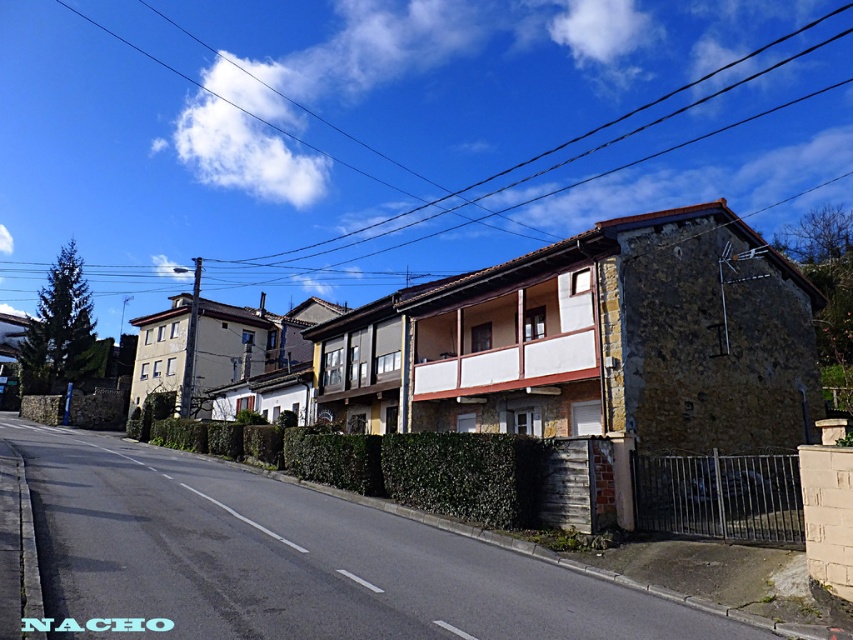
You are a delivery drone flying above the residential street scene. You need to deliver a package to a house near the green leafy hedge at center. However, you must avoid the brown wooden power line at upper center. Which object should you fly under first to navigate safely?

You should fly under the brown wooden power line at upper center first because it is closer to you than the green leafy hedge at center, so you need to pass under it before reaching the hedge.

You are a painter standing on the sidewalk and want to paint the brown wooden power line at upper center and the green leafy hedge at center. Which object should you focus on first if you want to paint the wider one first?

The brown wooden power line at upper center might be wider than green leafy hedge at center, so you should focus on painting the brown wooden power line at upper center first.

You are a drone operator planning to fly a drone from the brown wooden power line at upper center to the green leafy hedge at center. According to the scene, what is the approximate distance you need to cover in meters?

The brown wooden power line at upper center and green leafy hedge at center are 130.90 meters apart, so the approximate distance to cover is 130.90 meters.